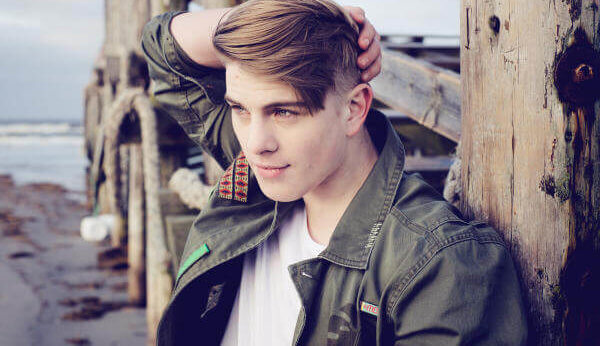
This screenshot has width=600, height=346. I want to click on wood post, so click(522, 105).